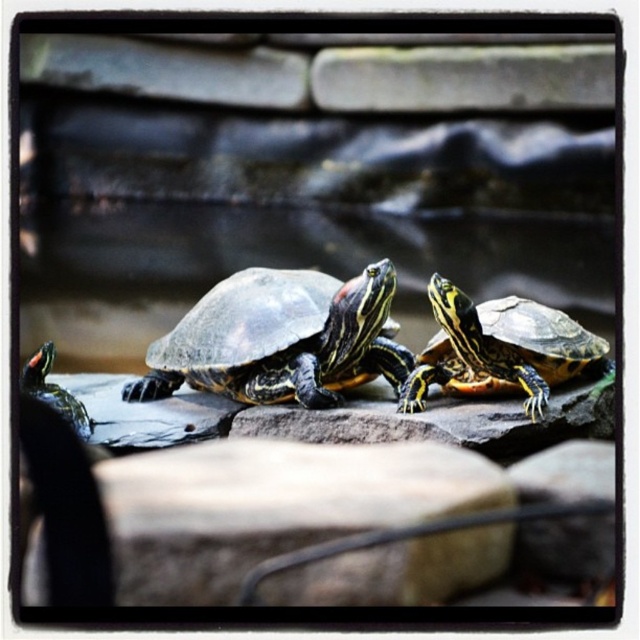
Based on the photo, can you confirm if shiny green tortoise at center is thinner than shiny green tortoise at lower left?

No.

Find the location of a particular element. shiny green tortoise at center is located at coordinates (280, 339).

Between shiny green tortoise at center and shiny green shell at center, which one has less height?

Standing shorter between the two is shiny green shell at center.

Is shiny green tortoise at center shorter than shiny green shell at center?

No.

Which is behind, point (273, 312) or point (538, 384)?

The point (273, 312) is behind.

Find the location of a particular element. shiny green tortoise at center is located at coordinates (280, 339).

Is point (493, 324) behind point (70, 413)?

Yes, point (493, 324) is behind point (70, 413).

I want to click on shiny green shell at center, so click(x=500, y=349).

Where is `shiny green shell at center`? shiny green shell at center is located at coordinates (500, 349).